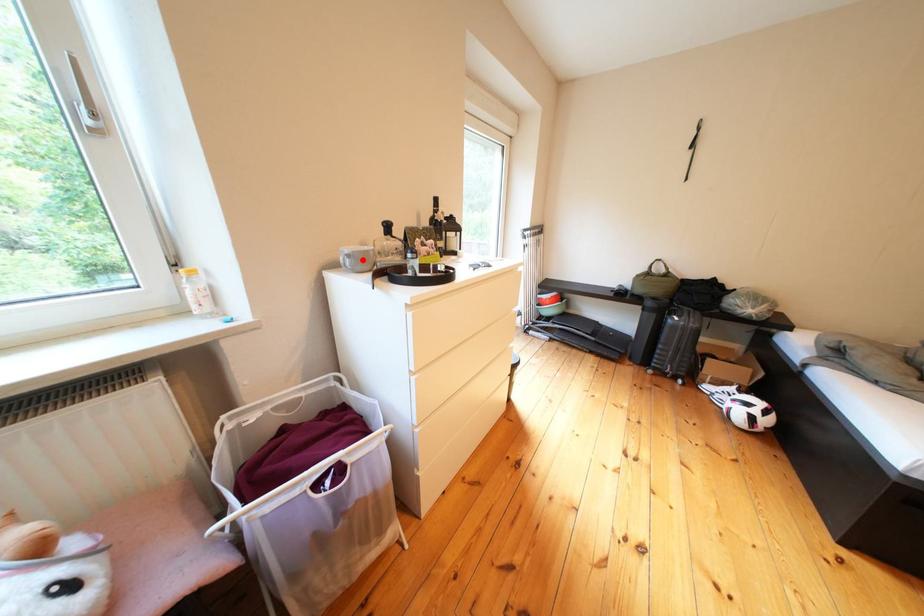
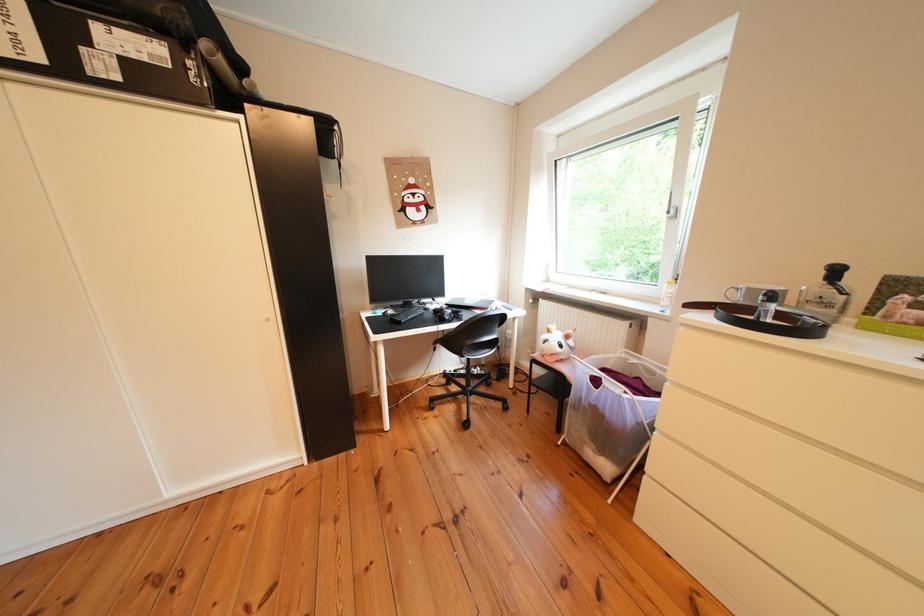
The point at the highlighted location is marked in the first image. Where is the corresponding point in the second image?

(751, 294)